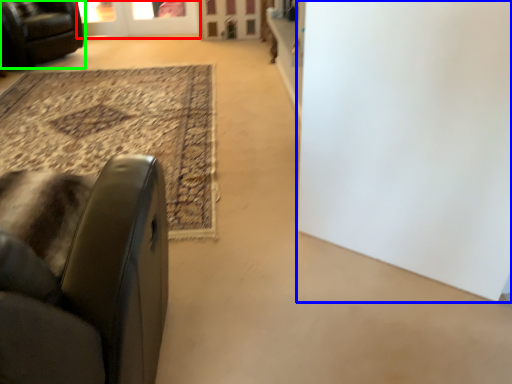
Question: Which is farther away from screen door (highlighted by a red box)? door (highlighted by a blue box) or chair (highlighted by a green box)?

Choices:
 (A) door
 (B) chair

Answer: (A)